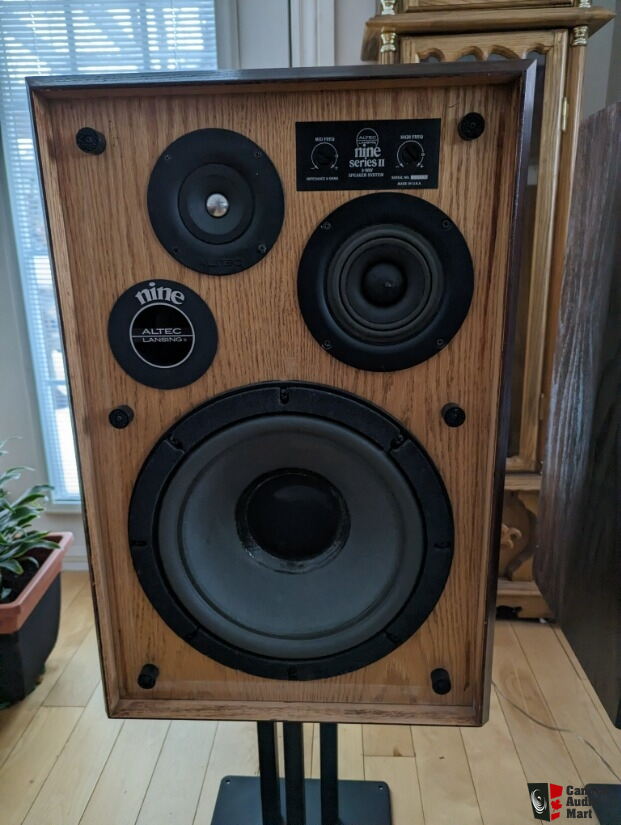
This screenshot has height=825, width=621. I want to click on large round speaker in black, so click(272, 416), click(158, 563), click(430, 535), click(312, 666).